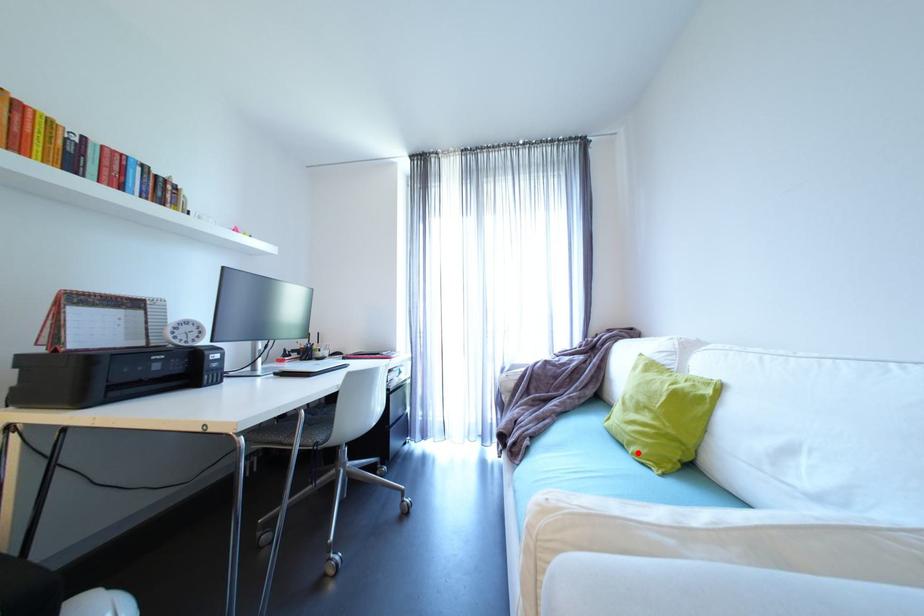
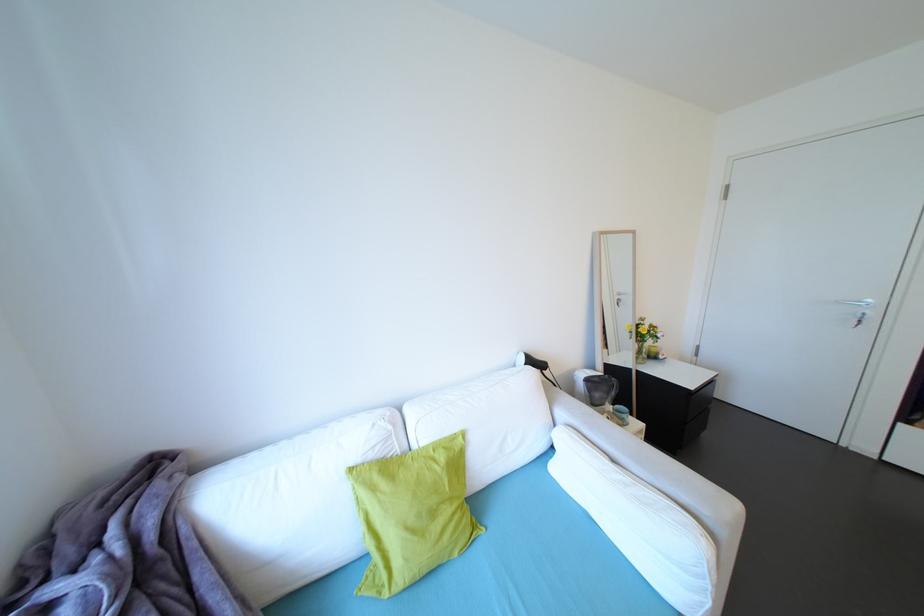
Find the pixel in the second image that matches the highlighted location in the first image.

(464, 556)